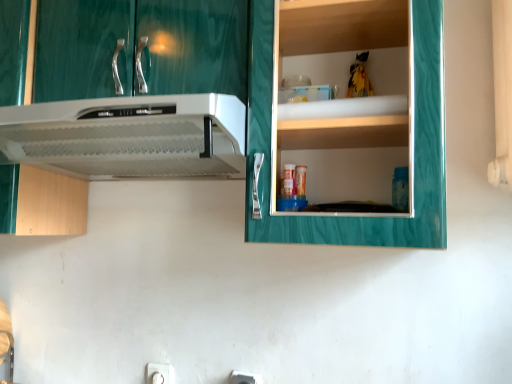
Question: From the image's perspective, relative to white plastic electric outlet at lower center, the second electric outlet in the left-to-right sequence, is white plastic electric outlet at lower center, the first electric outlet in the back-to-front sequence, above or below?

Choices:
 (A) below
 (B) above

Answer: (A)

Question: Visually, is white plastic electric outlet at lower center, the 1th electric outlet viewed from the left, positioned to the left or to the right of white plastic electric outlet at lower center, the second electric outlet in the left-to-right sequence?

Choices:
 (A) right
 (B) left

Answer: (B)

Question: Which is nearer to the white plastic electric outlet at lower center, the 1th electric outlet viewed from the left?

Choices:
 (A) white plastic range hood at upper left
 (B) green marble cabinet at upper right
 (C) white plastic electric outlet at lower center, marked as the first electric outlet in a front-to-back arrangement

Answer: (C)

Question: Which object is positioned farthest from the white plastic electric outlet at lower center, placed as the 2th electric outlet when sorted from front to back?

Choices:
 (A) white plastic range hood at upper left
 (B) white plastic electric outlet at lower center, arranged as the 2th electric outlet when viewed from the back
 (C) green marble cabinet at upper right

Answer: (C)